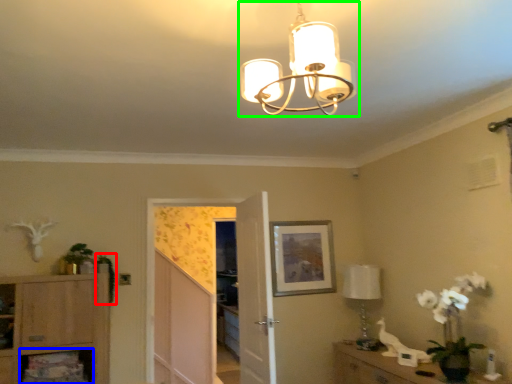
Question: Which object is the farthest from plant (highlighted by a red box)? Choose among these: shelf (highlighted by a blue box) or lamp (highlighted by a green box).

Choices:
 (A) shelf
 (B) lamp

Answer: (B)